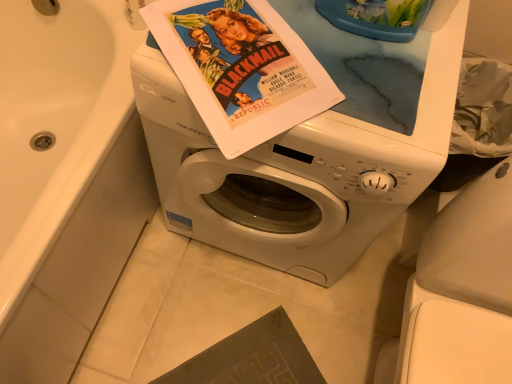
Question: Is white glossy bathtub at upper left turned away from matte paper movie poster at center?

Choices:
 (A) no
 (B) yes

Answer: (A)

Question: Is white glossy bathtub at upper left smaller than matte paper movie poster at center?

Choices:
 (A) no
 (B) yes

Answer: (A)

Question: Does white glossy bathtub at upper left have a greater height compared to matte paper movie poster at center?

Choices:
 (A) yes
 (B) no

Answer: (A)

Question: Does white glossy bathtub at upper left have a lesser height compared to matte paper movie poster at center?

Choices:
 (A) no
 (B) yes

Answer: (A)

Question: Can you confirm if white glossy bathtub at upper left is bigger than matte paper movie poster at center?

Choices:
 (A) no
 (B) yes

Answer: (B)

Question: Is white glossy washing machine at center taller or shorter than white glossy bathtub at upper left?

Choices:
 (A) tall
 (B) short

Answer: (A)

Question: Is point (321, 233) positioned closer to the camera than point (64, 344)?

Choices:
 (A) closer
 (B) farther

Answer: (A)

Question: Would you say white glossy washing machine at center is to the left or to the right of white glossy bathtub at upper left in the picture?

Choices:
 (A) right
 (B) left

Answer: (A)

Question: Is white glossy washing machine at center in front of or behind white glossy bathtub at upper left in the image?

Choices:
 (A) front
 (B) behind

Answer: (B)

Question: Visually, is white glossy bathtub at upper left positioned to the left or to the right of matte paper movie poster at center?

Choices:
 (A) left
 (B) right

Answer: (A)

Question: From a real-world perspective, is white glossy bathtub at upper left positioned above or below matte paper movie poster at center?

Choices:
 (A) below
 (B) above

Answer: (A)

Question: From the image's perspective, is white glossy bathtub at upper left above or below matte paper movie poster at center?

Choices:
 (A) above
 (B) below

Answer: (B)

Question: Is white glossy bathtub at upper left situated inside matte paper movie poster at center or outside?

Choices:
 (A) inside
 (B) outside

Answer: (B)

Question: Would you say matte paper movie poster at center is to the left or to the right of white glossy bathtub at upper left in the picture?

Choices:
 (A) left
 (B) right

Answer: (B)

Question: From the image's perspective, is matte paper movie poster at center positioned above or below white glossy bathtub at upper left?

Choices:
 (A) below
 (B) above

Answer: (B)